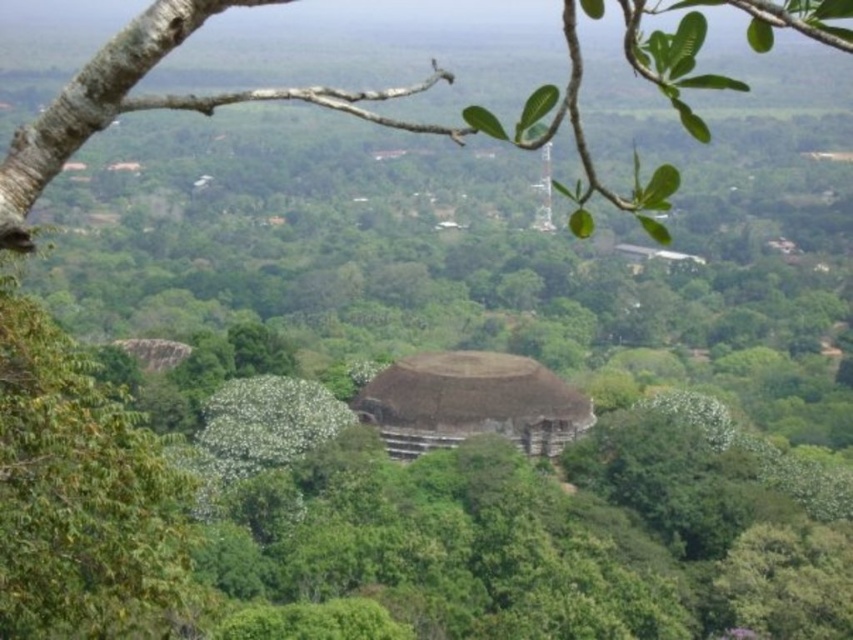
What do you see at coordinates (283, 99) in the screenshot? The image size is (853, 640). I see `green leafy branch at upper center` at bounding box center [283, 99].

Can you confirm if green leafy branch at upper center is positioned below brown thatch hut at center?

Actually, green leafy branch at upper center is above brown thatch hut at center.

Does point (41, 113) come closer to viewer compared to point (535, 397)?

No, it is behind (535, 397).

Identify the location of green leafy branch at upper center. (283, 99).